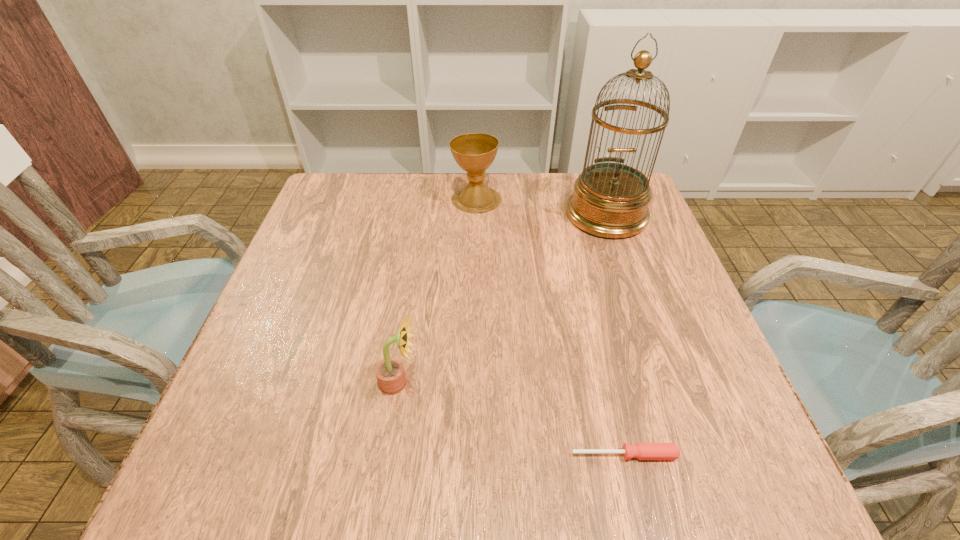
Identify the location of empty space that is in between the second object from left to right and the screwdriver. (550, 327).

Choose which object is the second nearest neighbor to the shortest object. Please provide its 2D coordinates. Your answer should be formatted as a tuple, i.e. [(x, y)], where the tuple contains the x and y coordinates of a point satisfying the conditions above.

[(610, 200)]

At what (x,y) coordinates should I click in order to perform the action: click on object that is the closest one to the birdcage. Please return your answer as a coordinate pair (x, y). This screenshot has height=540, width=960. Looking at the image, I should click on (474, 152).

This screenshot has height=540, width=960. I want to click on vacant space that satisfies the following two spatial constraints: 1. on the front side of the third object from right to left; 2. on the face of the sunflower, so click(474, 383).

Identify the location of free space that satisfies the following two spatial constraints: 1. with an open door on the tallest object; 2. on the face of the leftmost object. (665, 383).

Where is `free space that satisfies the following two spatial constraints: 1. with an open door on the tallest object; 2. on the face of the leftmost object`? This screenshot has width=960, height=540. free space that satisfies the following two spatial constraints: 1. with an open door on the tallest object; 2. on the face of the leftmost object is located at coordinates (665, 383).

This screenshot has height=540, width=960. Identify the location of vacant space that satisfies the following two spatial constraints: 1. on the back side of the shortest object; 2. on the face of the leftmost object. coord(608,383).

This screenshot has height=540, width=960. Find the location of `vacant space that satisfies the following two spatial constraints: 1. on the face of the shortest object; 2. on the left side of the leftmost object`. vacant space that satisfies the following two spatial constraints: 1. on the face of the shortest object; 2. on the left side of the leftmost object is located at coordinates (388, 455).